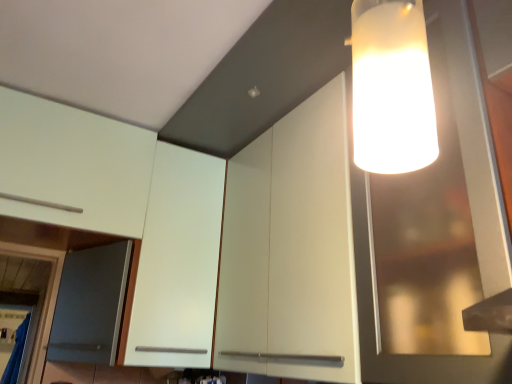
Locate an element on the screen. white matte cabinet at upper left, arranged as the 2th cabinetry when viewed from the left is located at coordinates (178, 262).

The width and height of the screenshot is (512, 384). What are the coordinates of `white matte cabinet at upper left, which ranks as the first cabinetry in left-to-right order` in the screenshot? It's located at (73, 165).

Where is `white matte cabinet at upper left, marked as the second cabinetry in a right-to-left arrangement`? The width and height of the screenshot is (512, 384). white matte cabinet at upper left, marked as the second cabinetry in a right-to-left arrangement is located at coordinates (178, 262).

Is white matte cabinet at upper left, which ranks as the first cabinetry in left-to-right order, turned away from white matte cabinet at upper left, arranged as the 2th cabinetry when viewed from the left?

That's not correct — white matte cabinet at upper left, which ranks as the first cabinetry in left-to-right order, is not looking away from white matte cabinet at upper left, arranged as the 2th cabinetry when viewed from the left.

Is white matte cabinet at upper left, which ranks as the first cabinetry in left-to-right order, inside or outside of white matte cabinet at upper left, arranged as the 2th cabinetry when viewed from the left?

white matte cabinet at upper left, which ranks as the first cabinetry in left-to-right order, is enclosed within white matte cabinet at upper left, arranged as the 2th cabinetry when viewed from the left.

Are white matte cabinet at upper left, which is counted as the third cabinetry, starting from the right, and white matte cabinet at upper left, arranged as the 2th cabinetry when viewed from the left, beside each other?

No, white matte cabinet at upper left, which is counted as the third cabinetry, starting from the right, is not touching white matte cabinet at upper left, arranged as the 2th cabinetry when viewed from the left.

Which is closer to the camera, (156, 292) or (286, 128)?

Point (156, 292) is farther from the camera than point (286, 128).

Between white matte cabinet at upper left, arranged as the 2th cabinetry when viewed from the left, and white matte cabinet at upper right, placed as the third cabinetry when sorted from left to right, which one appears on the left side from the viewer's perspective?

From the viewer's perspective, white matte cabinet at upper left, arranged as the 2th cabinetry when viewed from the left, appears more on the left side.

Locate an element on the screen. cabinetry that is the 2nd one when counting forward from the white matte cabinet at upper left, arranged as the 2th cabinetry when viewed from the left is located at coordinates (290, 250).

Is transparent glass cabinet at upper right positioned with its back to white matte cabinet at upper right, arranged as the 1th cabinetry when viewed from the right?

That's right, transparent glass cabinet at upper right is facing away from white matte cabinet at upper right, arranged as the 1th cabinetry when viewed from the right.

From the image's perspective, count 1st cabinetrys downward from the transparent glass cabinet at upper right and point to it. Please provide its 2D coordinates.

[(290, 250)]

From the image's perspective, which one is positioned higher, transparent glass cabinet at upper right or white matte cabinet at upper right, placed as the third cabinetry when sorted from left to right?

transparent glass cabinet at upper right is shown above in the image.

Can you confirm if transparent glass cabinet at upper right is smaller than white matte cabinet at upper right, placed as the third cabinetry when sorted from left to right?

Actually, transparent glass cabinet at upper right might be larger than white matte cabinet at upper right, placed as the third cabinetry when sorted from left to right.

Is white matte cabinet at upper left, marked as the second cabinetry in a right-to-left arrangement, positioned with its back to white matte cabinet at upper left, which ranks as the first cabinetry in left-to-right order?

white matte cabinet at upper left, marked as the second cabinetry in a right-to-left arrangement, is not turned away from white matte cabinet at upper left, which ranks as the first cabinetry in left-to-right order.

In the scene shown: Is white matte cabinet at upper left, arranged as the 2th cabinetry when viewed from the left, thinner than white matte cabinet at upper left, which is counted as the third cabinetry, starting from the right?

Indeed, white matte cabinet at upper left, arranged as the 2th cabinetry when viewed from the left, has a lesser width compared to white matte cabinet at upper left, which is counted as the third cabinetry, starting from the right.

Is white matte cabinet at upper left, which ranks as the first cabinetry in left-to-right order, inside white matte cabinet at upper left, marked as the second cabinetry in a right-to-left arrangement?

Yes, white matte cabinet at upper left, marked as the second cabinetry in a right-to-left arrangement, is surrounding white matte cabinet at upper left, which ranks as the first cabinetry in left-to-right order.

How distant is white matte cabinet at upper left, marked as the second cabinetry in a right-to-left arrangement, from white matte cabinet at upper left, which is counted as the third cabinetry, starting from the right?

10.83 inches.

Is white matte cabinet at upper right, placed as the third cabinetry when sorted from left to right, at the right side of white matte cabinet at upper left, arranged as the 2th cabinetry when viewed from the left?

Yes, white matte cabinet at upper right, placed as the third cabinetry when sorted from left to right, is to the right of white matte cabinet at upper left, arranged as the 2th cabinetry when viewed from the left.

From the image's perspective, between white matte cabinet at upper right, placed as the third cabinetry when sorted from left to right, and white matte cabinet at upper left, marked as the second cabinetry in a right-to-left arrangement, who is located below?

white matte cabinet at upper left, marked as the second cabinetry in a right-to-left arrangement.

Considering the relative sizes of white matte cabinet at upper right, arranged as the 1th cabinetry when viewed from the right, and white matte cabinet at upper left, marked as the second cabinetry in a right-to-left arrangement, in the image provided, is white matte cabinet at upper right, arranged as the 1th cabinetry when viewed from the right, thinner than white matte cabinet at upper left, marked as the second cabinetry in a right-to-left arrangement,?

Correct, the width of white matte cabinet at upper right, arranged as the 1th cabinetry when viewed from the right, is less than that of white matte cabinet at upper left, marked as the second cabinetry in a right-to-left arrangement.

Does white matte cabinet at upper right, arranged as the 1th cabinetry when viewed from the right, turn towards white matte cabinet at upper left, arranged as the 2th cabinetry when viewed from the left?

No, white matte cabinet at upper right, arranged as the 1th cabinetry when viewed from the right, is not oriented towards white matte cabinet at upper left, arranged as the 2th cabinetry when viewed from the left.

Considering the positions of objects white matte cabinet at upper left, marked as the second cabinetry in a right-to-left arrangement, and transparent glass cabinet at upper right in the image provided, who is more to the right, white matte cabinet at upper left, marked as the second cabinetry in a right-to-left arrangement, or transparent glass cabinet at upper right?

From the viewer's perspective, transparent glass cabinet at upper right appears more on the right side.

Does white matte cabinet at upper left, marked as the second cabinetry in a right-to-left arrangement, have a smaller size compared to transparent glass cabinet at upper right?

Indeed, white matte cabinet at upper left, marked as the second cabinetry in a right-to-left arrangement, has a smaller size compared to transparent glass cabinet at upper right.

At what (x,y) coordinates should I click in order to perform the action: click on glass door that appears above the white matte cabinet at upper left, marked as the second cabinetry in a right-to-left arrangement (from a real-world perspective). Please return your answer as a coordinate pair (x, y). Image resolution: width=512 pixels, height=384 pixels. Looking at the image, I should click on (435, 234).

In terms of height, does transparent glass cabinet at upper right look taller or shorter compared to white matte cabinet at upper left, which is counted as the third cabinetry, starting from the right?

In the image, transparent glass cabinet at upper right appears to be taller than white matte cabinet at upper left, which is counted as the third cabinetry, starting from the right.

How many degrees apart are the facing directions of transparent glass cabinet at upper right and white matte cabinet at upper left, which is counted as the third cabinetry, starting from the right?

They differ by 88.5 degrees in their facing directions.

From a real-world perspective, which object rests below the other?

From a 3D spatial view, transparent glass cabinet at upper right is below.

Locate an element on the screen. The height and width of the screenshot is (384, 512). glass door below the white matte cabinet at upper left, which is counted as the third cabinetry, starting from the right (from the image's perspective) is located at coordinates (435, 234).

The width and height of the screenshot is (512, 384). I want to click on cabinetry located behind the white matte cabinet at upper left, which is counted as the third cabinetry, starting from the right, so click(x=178, y=262).

Locate an element on the screen. The height and width of the screenshot is (384, 512). cabinetry that appears below the white matte cabinet at upper left, arranged as the 2th cabinetry when viewed from the left (from a real-world perspective) is located at coordinates (290, 250).

Looking at the image, which one is located further to white matte cabinet at upper left, arranged as the 2th cabinetry when viewed from the left, white matte cabinet at upper right, arranged as the 1th cabinetry when viewed from the right, or white matte cabinet at upper left, which is counted as the third cabinetry, starting from the right?

The object further to white matte cabinet at upper left, arranged as the 2th cabinetry when viewed from the left, is white matte cabinet at upper right, arranged as the 1th cabinetry when viewed from the right.

Considering their positions, is white matte cabinet at upper right, placed as the third cabinetry when sorted from left to right, positioned further to white matte cabinet at upper left, which is counted as the third cabinetry, starting from the right, than transparent glass cabinet at upper right?

transparent glass cabinet at upper right is positioned further to the anchor white matte cabinet at upper left, which is counted as the third cabinetry, starting from the right.

From the image, which object appears to be farther from white matte cabinet at upper left, arranged as the 2th cabinetry when viewed from the left, white matte cabinet at upper right, arranged as the 1th cabinetry when viewed from the right, or transparent glass cabinet at upper right?

Among the two, transparent glass cabinet at upper right is located further to white matte cabinet at upper left, arranged as the 2th cabinetry when viewed from the left.

Based on their spatial positions, is white matte cabinet at upper right, placed as the third cabinetry when sorted from left to right, or white matte cabinet at upper left, which is counted as the third cabinetry, starting from the right, further from transparent glass cabinet at upper right?

white matte cabinet at upper left, which is counted as the third cabinetry, starting from the right.

Looking at the image, which one is located closer to white matte cabinet at upper left, arranged as the 2th cabinetry when viewed from the left, white matte cabinet at upper left, which is counted as the third cabinetry, starting from the right, or transparent glass cabinet at upper right?

The object closer to white matte cabinet at upper left, arranged as the 2th cabinetry when viewed from the left, is white matte cabinet at upper left, which is counted as the third cabinetry, starting from the right.

Based on their spatial positions, is transparent glass cabinet at upper right or white matte cabinet at upper left, marked as the second cabinetry in a right-to-left arrangement, further from white matte cabinet at upper left, which is counted as the third cabinetry, starting from the right?

transparent glass cabinet at upper right is further to white matte cabinet at upper left, which is counted as the third cabinetry, starting from the right.

From the image, which object appears to be farther from white matte cabinet at upper left, marked as the second cabinetry in a right-to-left arrangement, transparent glass cabinet at upper right or white matte cabinet at upper left, which ranks as the first cabinetry in left-to-right order?

Based on the image, transparent glass cabinet at upper right appears to be further to white matte cabinet at upper left, marked as the second cabinetry in a right-to-left arrangement.

Estimate the real-world distances between objects in this image. Which object is closer to white matte cabinet at upper left, which ranks as the first cabinetry in left-to-right order, white matte cabinet at upper left, marked as the second cabinetry in a right-to-left arrangement, or white matte cabinet at upper right, placed as the third cabinetry when sorted from left to right?

white matte cabinet at upper left, marked as the second cabinetry in a right-to-left arrangement, lies closer to white matte cabinet at upper left, which ranks as the first cabinetry in left-to-right order, than the other object.

This screenshot has width=512, height=384. Find the location of `cabinetry between white matte cabinet at upper left, which is counted as the third cabinetry, starting from the right, and white matte cabinet at upper right, arranged as the 1th cabinetry when viewed from the right, in the horizontal direction`. cabinetry between white matte cabinet at upper left, which is counted as the third cabinetry, starting from the right, and white matte cabinet at upper right, arranged as the 1th cabinetry when viewed from the right, in the horizontal direction is located at coordinates (178, 262).

Image resolution: width=512 pixels, height=384 pixels. I want to click on cabinetry situated between white matte cabinet at upper left, arranged as the 2th cabinetry when viewed from the left, and transparent glass cabinet at upper right from left to right, so click(x=290, y=250).